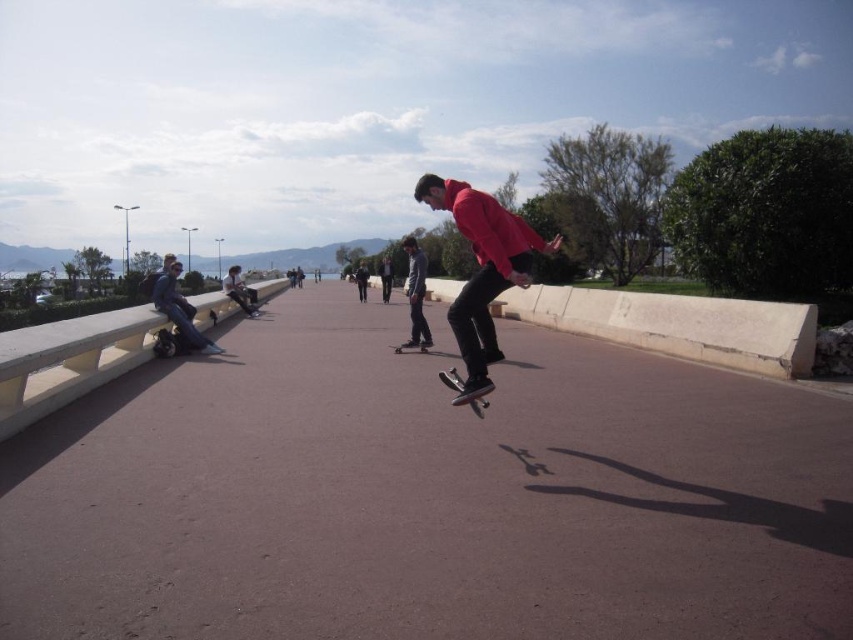
From the picture: Does matte red hoodie at center have a lesser height compared to black matte skateboard at center?

Incorrect, matte red hoodie at center's height does not fall short of black matte skateboard at center's.

What are the coordinates of `matte red hoodie at center` in the screenshot? It's located at (482, 269).

Who is positioned more to the right, matte red hoodie at center or matte blue jacket at left?

matte red hoodie at center

Is matte red hoodie at center thinner than matte blue jacket at left?

In fact, matte red hoodie at center might be wider than matte blue jacket at left.

Measure the distance between point (500, 257) and camera.

The distance of point (500, 257) from camera is 17.12 feet.

The width and height of the screenshot is (853, 640). Find the location of `matte red hoodie at center`. matte red hoodie at center is located at coordinates (482, 269).

Is point (547, 243) in front of point (413, 317)?

Yes, point (547, 243) is in front of point (413, 317).

Who is more forward, (x=457, y=202) or (x=421, y=339)?

Point (x=457, y=202) is more forward.

Which is in front, point (426, 184) or point (415, 342)?

Point (426, 184)

Where is `matte red hoodie at center`? The width and height of the screenshot is (853, 640). matte red hoodie at center is located at coordinates (482, 269).